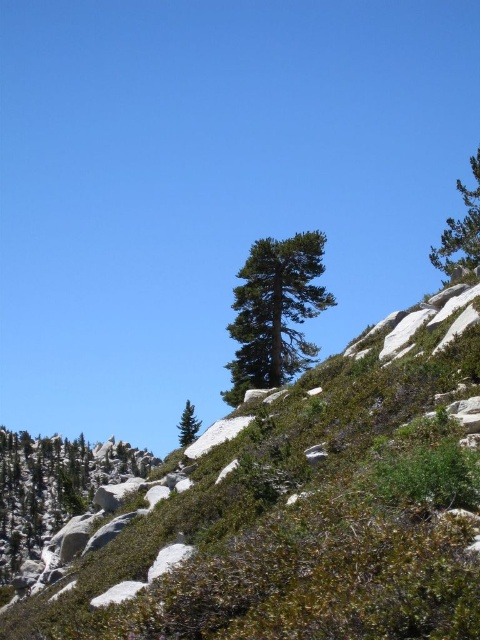
You are a hiker trying to navigate between the green textured pine at center and the green matte tree at center. Given that your backpack can only carry enough water for a 10 meter hike, can you safely travel between them without needing more water?

The distance between the green textured pine at center and the green matte tree at center is 15.05 meters, which exceeds the 10 meter capacity of your water supply. Therefore, you cannot safely travel between them without needing more water.